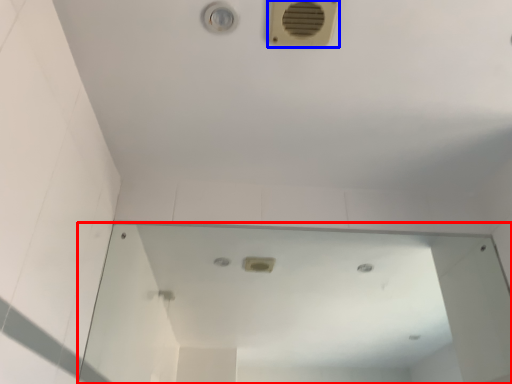
Question: Which object is closer to the camera taking this photo, mirror (highlighted by a red box) or air conditioning (highlighted by a blue box)?

Choices:
 (A) mirror
 (B) air conditioning

Answer: (B)